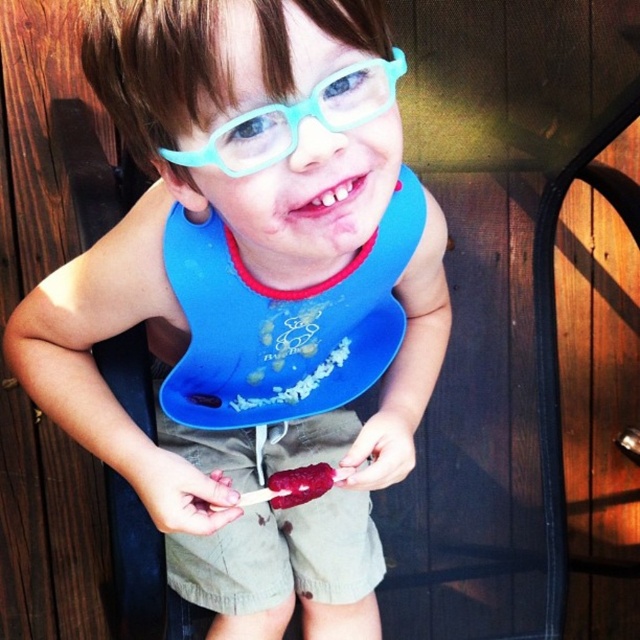
Question: Does blue rubber bib at center appear on the right side of tinted plastic glasses at upper center?

Choices:
 (A) yes
 (B) no

Answer: (B)

Question: Which of the following is the farthest from the observer?

Choices:
 (A) (180, 70)
 (B) (291, 504)
 (C) (252, 148)

Answer: (B)

Question: Does tinted plastic glasses at upper center come behind smooth raspberry ice cream at center?

Choices:
 (A) yes
 (B) no

Answer: (B)

Question: Which point is farther from the camera taking this photo?

Choices:
 (A) (330, 480)
 (B) (172, 538)

Answer: (B)

Question: Is blue rubber bib at center wider than smooth raspberry ice cream at center?

Choices:
 (A) yes
 (B) no

Answer: (A)

Question: Which object appears closest to the camera in this image?

Choices:
 (A) smooth raspberry ice cream at center
 (B) blue rubber bib at center

Answer: (B)